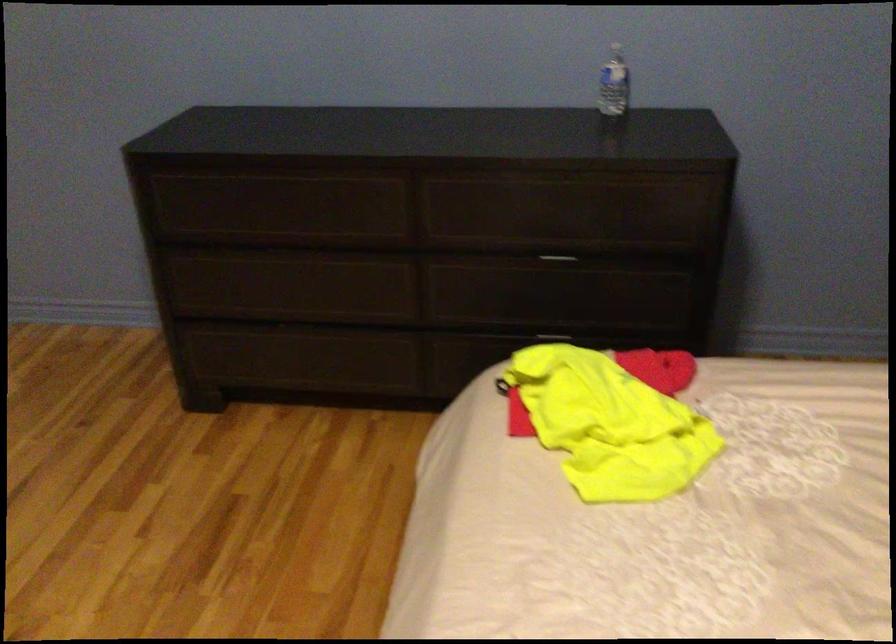
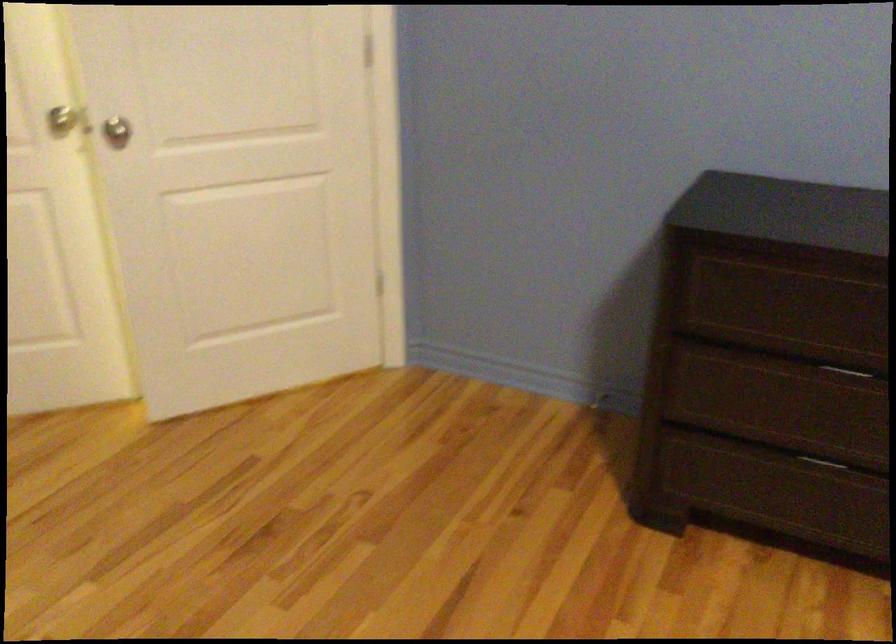
Locate, in the second image, the point that corresponds to (x=280, y=252) in the first image.

(850, 371)